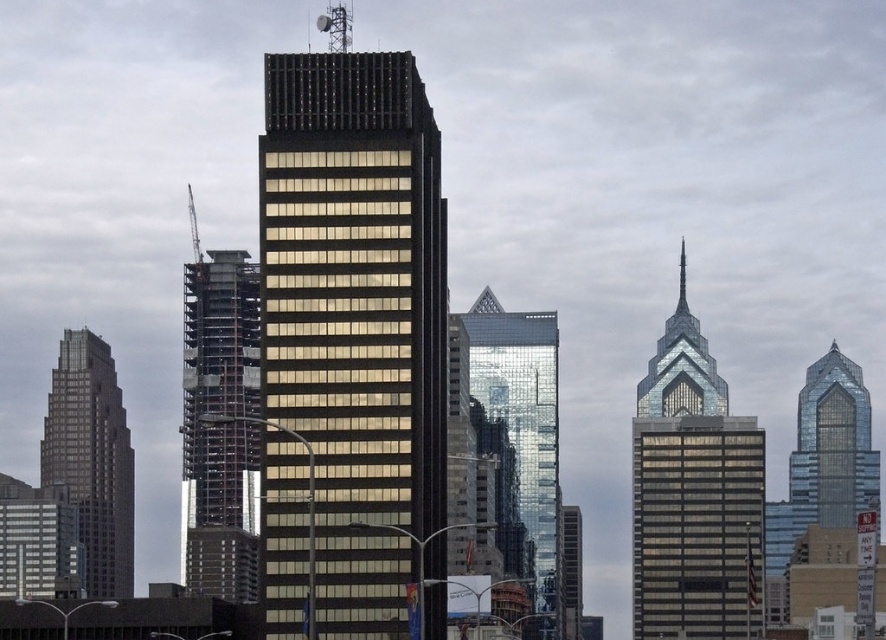
Does glassy reflective skyscraper at center have a greater width compared to reflective glass skyscraper at center?

Yes.

Can you confirm if glassy reflective skyscraper at center is taller than reflective glass skyscraper at center?

Yes.

Identify the location of glassy reflective skyscraper at center. (693, 493).

Does metallic silver construction at left have a larger size compared to glassy gray skyscraper at left?

Yes, metallic silver construction at left is bigger than glassy gray skyscraper at left.

Which is behind, point (214, 522) or point (122, 579)?

Point (122, 579)

I want to click on metallic silver construction at left, so click(220, 426).

Who is higher up, black glass building at center or metallic silver construction at left?

Positioned higher is black glass building at center.

Can you confirm if black glass building at center is positioned below metallic silver construction at left?

Incorrect, black glass building at center is not positioned below metallic silver construction at left.

In order to click on black glass building at center in this screenshot , I will do `click(356, 316)`.